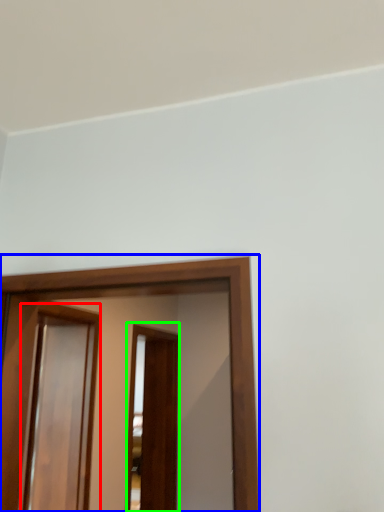
Question: Estimate the real-world distances between objects in this image. Which object is closer to screen door (highlighted by a red box), screen door (highlighted by a blue box) or screen door (highlighted by a green box)?

Choices:
 (A) screen door
 (B) screen door

Answer: (A)